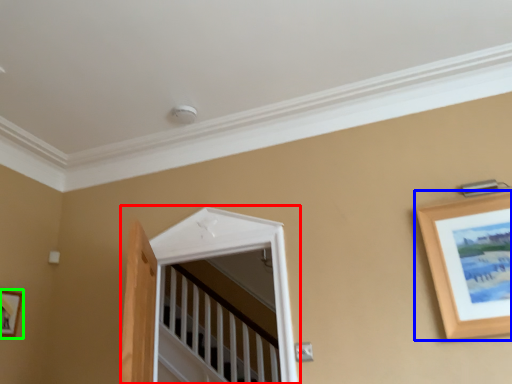
Question: Which object is positioned closest to window (highlighted by a red box)? Select from picture frame (highlighted by a blue box) and picture frame (highlighted by a green box).

Choices:
 (A) picture frame
 (B) picture frame

Answer: (A)